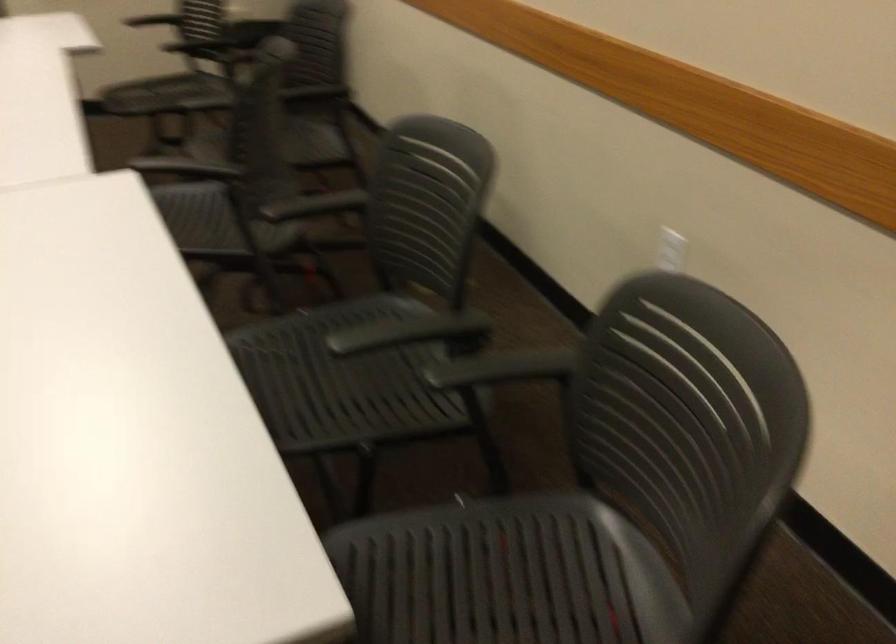
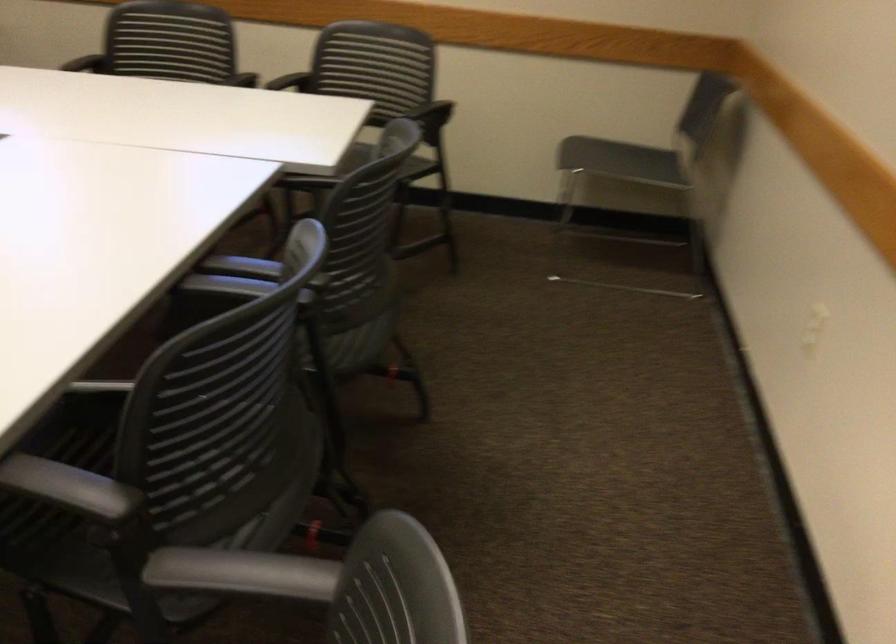
In the second image, find the point that corresponds to (442,207) in the first image.

(168, 41)